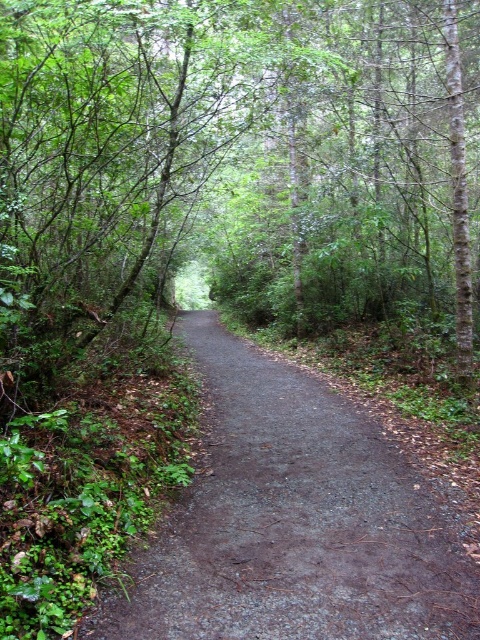
You are a hiker carrying a backpack and want to take a photo of the green leafy tree at center. Your camera has a minimum focusing distance of 2 meters. Can you take a clear photo without moving closer?

The green leafy tree at center is 1.79 meters from the camera, which is closer than the minimum focusing distance of 2 meters. Therefore, you cannot take a clear photo without moving further back.